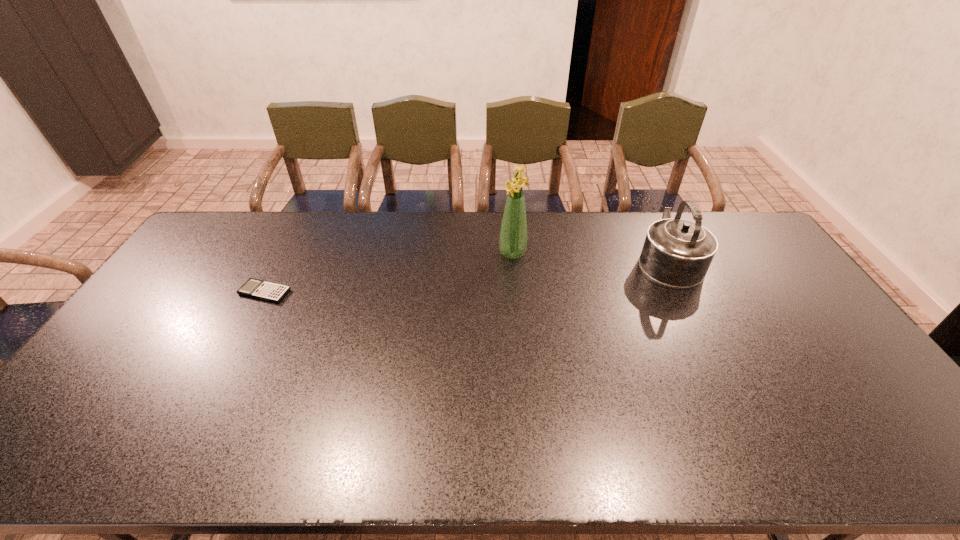
This screenshot has height=540, width=960. I want to click on vacant space that satisfies the following two spatial constraints: 1. on the front-facing side of the tallest object; 2. with the spout at the front of the kettle, so click(x=513, y=260).

At what (x,y) coordinates should I click in order to perform the action: click on blank space that satisfies the following two spatial constraints: 1. with the spout at the front of the rightmost object; 2. on the front-facing side of the tallest object. Please return your answer as a coordinate pair (x, y). Looking at the image, I should click on (665, 253).

This screenshot has width=960, height=540. What are the coordinates of `free space that satisfies the following two spatial constraints: 1. on the front-facing side of the tallest object; 2. with the spout at the front of the second shortest object` in the screenshot? It's located at (513, 260).

The width and height of the screenshot is (960, 540). I want to click on vacant area in the image that satisfies the following two spatial constraints: 1. with the spout at the front of the rightmost object; 2. on the front-facing side of the second object from left to right, so click(x=665, y=253).

Find the location of a particular element. This screenshot has height=540, width=960. free location that satisfies the following two spatial constraints: 1. with the spout at the front of the rightmost object; 2. on the front-facing side of the second object from left to right is located at coordinates (665, 253).

Find the location of a particular element. The height and width of the screenshot is (540, 960). vacant space that satisfies the following two spatial constraints: 1. on the front-facing side of the bouquet; 2. with the spout at the front of the kettle is located at coordinates (513, 260).